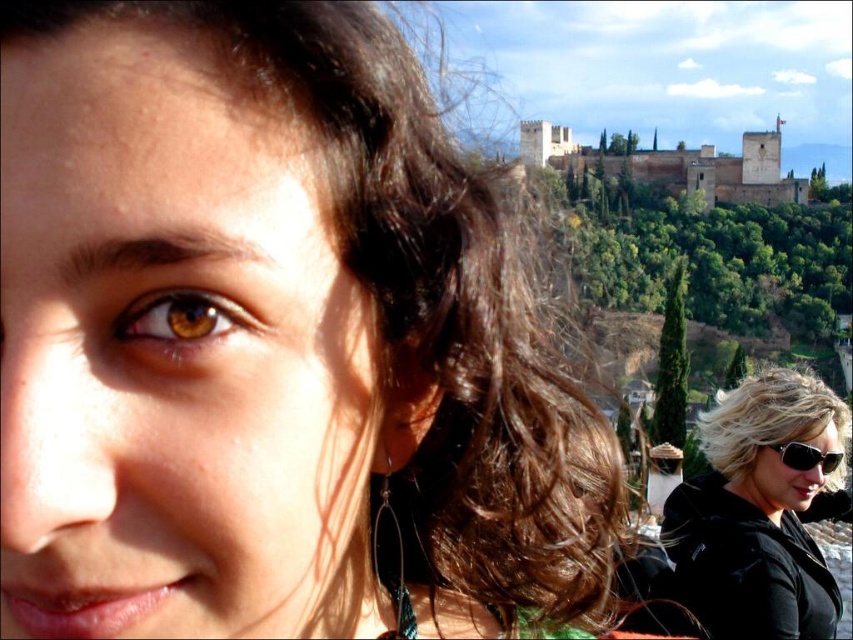
Between blonde hair at right and black plastic sunglasses at right, which one has more height?

Standing taller between the two is blonde hair at right.

Is point (798, 397) behind point (840, 451)?

Yes, point (798, 397) is farther from viewer.

Image resolution: width=853 pixels, height=640 pixels. I want to click on blonde hair at right, so click(770, 419).

Does black matte sunglasses at lower right have a larger size compared to black plastic sunglasses at right?

Indeed, black matte sunglasses at lower right has a larger size compared to black plastic sunglasses at right.

Does black matte sunglasses at lower right appear over black plastic sunglasses at right?

Yes.

Where is `black matte sunglasses at lower right`? The image size is (853, 640). black matte sunglasses at lower right is located at coordinates (759, 509).

This screenshot has width=853, height=640. What are the coordinates of `black matte sunglasses at lower right` in the screenshot? It's located at (759, 509).

Is brown glossy eye at center further to camera compared to black plastic sunglasses at right?

No, brown glossy eye at center is closer to the viewer.

Between point (137, 337) and point (788, 467), which one is positioned in front?

Point (137, 337) is more forward.

Who is more distant from viewer, (213, 320) or (828, 451)?

The point (828, 451) is more distant.

Identify the location of brown glossy eye at center. (183, 321).